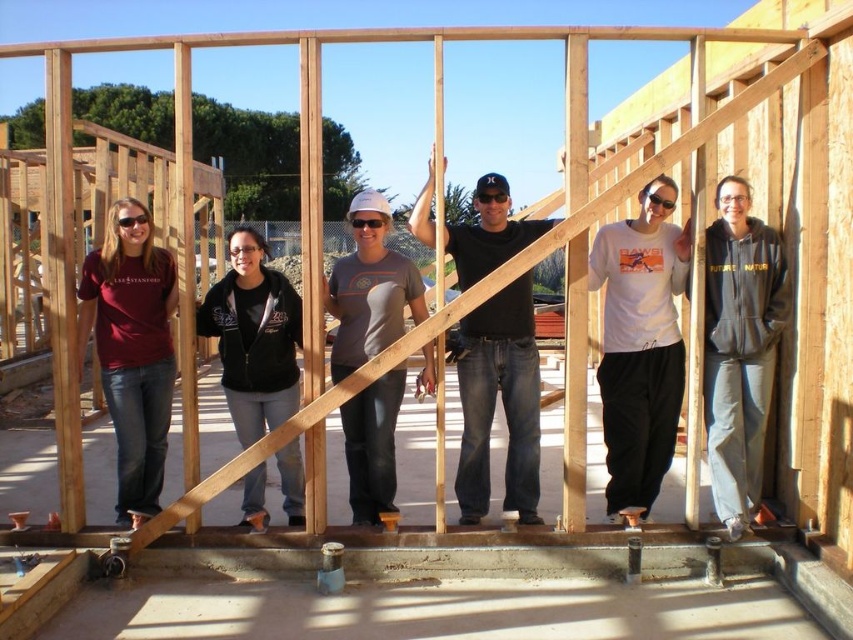
Question: Is white matte t-shirt at center thinner than gray matte t-shirt at center?

Choices:
 (A) yes
 (B) no

Answer: (A)

Question: Is white matte t-shirt at center to the right of gray fleece hoodie at center from the viewer's perspective?

Choices:
 (A) yes
 (B) no

Answer: (B)

Question: Which is nearer to the white matte t-shirt at center?

Choices:
 (A) black matte shirt at center
 (B) gray fleece hoodie at center
 (C) gray matte t-shirt at center

Answer: (B)

Question: Which of the following is the farthest from the observer?

Choices:
 (A) (508, 193)
 (B) (718, 220)

Answer: (A)

Question: Considering the real-world distances, which object is farthest from the gray matte t-shirt at center?

Choices:
 (A) white matte t-shirt at center
 (B) gray fleece hoodie at center
 (C) black matte shirt at center

Answer: (B)

Question: Is white matte t-shirt at center wider than gray matte t-shirt at center?

Choices:
 (A) no
 (B) yes

Answer: (A)